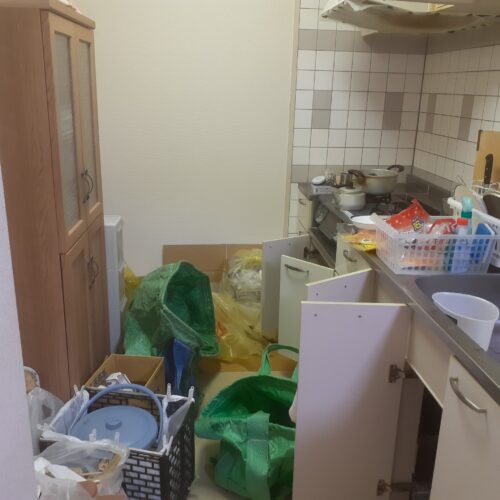
At what (x,y) coordinates should I click in order to perform the action: click on handle. Please return your answer as a coordinate pair (x, y). Looking at the image, I should click on (458, 400), (91, 279), (83, 197), (92, 214), (105, 307).